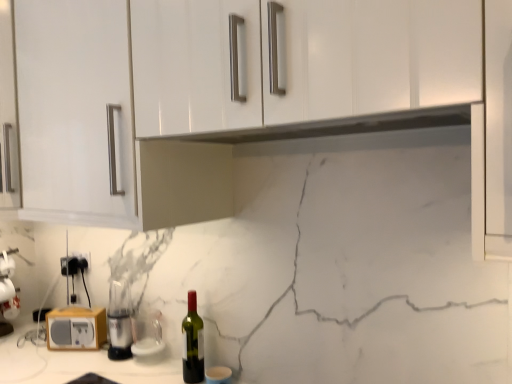
Describe the element at coordinates (76, 328) in the screenshot. I see `wooden radio at lower left, acting as the first appliance starting from the left` at that location.

Measure the distance between transparent glass at lower center, arranged as the third appliance when viewed from the left, and camera.

transparent glass at lower center, arranged as the third appliance when viewed from the left, is 5.10 feet away from camera.

Image resolution: width=512 pixels, height=384 pixels. What do you see at coordinates (119, 321) in the screenshot? I see `metallic silver blender at center, the 2th appliance from the left` at bounding box center [119, 321].

You are a GUI agent. You are given a task and a screenshot of the screen. Output one action in this format:
    pyautogui.click(x=<x>, y=<y>)
    Task: Click on the metallic silver blender at center, the second appliance in the right-to-left sequence
    
    Given the screenshot: What is the action you would take?
    pyautogui.click(x=119, y=321)

The height and width of the screenshot is (384, 512). Describe the element at coordinates (7, 291) in the screenshot. I see `translucent plastic blender at lower left` at that location.

How much space does black plastic electric outlet at lower left, which appears as the 2th electric outlet when viewed from the left, occupy vertically?

3.70 inches.

Identify the location of black plastic electric outlet at lower left, which appears as the 2th electric outlet when viewed from the left. Image resolution: width=512 pixels, height=384 pixels. (83, 257).

What do you see at coordinates (70, 266) in the screenshot? The width and height of the screenshot is (512, 384). I see `black plastic electric outlet at lower left, the 2th electric outlet when ordered from right to left` at bounding box center [70, 266].

In order to click on green glass bottle at center in this screenshot , I will do `click(192, 343)`.

From the image's perspective, relative to wooden radio at lower left, acting as the first appliance starting from the left, is black plastic electric outlet at lower left, which is the first electric outlet in right-to-left order, above or below?

Based on their image positions, black plastic electric outlet at lower left, which is the first electric outlet in right-to-left order, is located above wooden radio at lower left, acting as the first appliance starting from the left.

In terms of height, does black plastic electric outlet at lower left, which appears as the 2th electric outlet when viewed from the left, look taller or shorter compared to wooden radio at lower left, the third appliance when ordered from right to left?

Clearly, black plastic electric outlet at lower left, which appears as the 2th electric outlet when viewed from the left, is shorter compared to wooden radio at lower left, the third appliance when ordered from right to left.

Locate an element on the screen. This screenshot has height=384, width=512. the 1st electric outlet behind the wooden radio at lower left, the third appliance when ordered from right to left, counting from the anchor's position is located at coordinates (83, 257).

Between black plastic electric outlet at lower left, which is the first electric outlet in right-to-left order, and metallic silver blender at center, the second appliance in the right-to-left sequence, which one has smaller width?

With smaller width is black plastic electric outlet at lower left, which is the first electric outlet in right-to-left order.

Identify the location of the 2nd appliance below the black plastic electric outlet at lower left, which is the first electric outlet in right-to-left order (from the image's perspective). [x=119, y=321].

Is translucent plastic blender at lower left shorter than metallic silver blender at center, the second appliance in the right-to-left sequence?

No, translucent plastic blender at lower left is not shorter than metallic silver blender at center, the second appliance in the right-to-left sequence.

Is translucent plastic blender at lower left beside metallic silver blender at center, the 2th appliance from the left?

No, translucent plastic blender at lower left is not making contact with metallic silver blender at center, the 2th appliance from the left.

Is point (12, 268) farther from viewer compared to point (109, 306)?

Yes.

From a real-world perspective, which is physically below, translucent plastic blender at lower left or metallic silver blender at center, the second appliance in the right-to-left sequence?

From a 3D spatial view, metallic silver blender at center, the second appliance in the right-to-left sequence, is below.

Is green glass bottle at center facing away from metallic silver blender at center, the second appliance in the right-to-left sequence?

No, green glass bottle at center is not facing the opposite direction of metallic silver blender at center, the second appliance in the right-to-left sequence.

Is green glass bottle at center situated inside metallic silver blender at center, the second appliance in the right-to-left sequence, or outside?

green glass bottle at center is not inside metallic silver blender at center, the second appliance in the right-to-left sequence, it's outside.

From a real-world perspective, is green glass bottle at center positioned under metallic silver blender at center, the 2th appliance from the left, based on gravity?

Incorrect, from a real-world perspective, green glass bottle at center is higher than metallic silver blender at center, the 2th appliance from the left.

Measure the distance from green glass bottle at center to metallic silver blender at center, the second appliance in the right-to-left sequence.

They are 11.53 inches apart.

Between point (184, 325) and point (51, 337), which one is positioned in front?

The point (184, 325) is closer.

Does green glass bottle at center touch wooden radio at lower left, the third appliance when ordered from right to left?

No, green glass bottle at center is not next to wooden radio at lower left, the third appliance when ordered from right to left.

Is green glass bottle at center positioned with its back to wooden radio at lower left, the third appliance when ordered from right to left?

green glass bottle at center does not have its back to wooden radio at lower left, the third appliance when ordered from right to left.

Consider the image. Does green glass bottle at center lie behind wooden radio at lower left, acting as the first appliance starting from the left?

No, green glass bottle at center is in front of wooden radio at lower left, acting as the first appliance starting from the left.

From their relative heights in the image, would you say transparent glass at lower center, arranged as the first appliance when viewed from the right, is taller or shorter than green glass bottle at center?

In the image, transparent glass at lower center, arranged as the first appliance when viewed from the right, appears to be shorter than green glass bottle at center.

Looking at this image, from a real-world perspective, is transparent glass at lower center, arranged as the first appliance when viewed from the right, below green glass bottle at center?

Correct, in the physical world, transparent glass at lower center, arranged as the first appliance when viewed from the right, is lower than green glass bottle at center.

Can you confirm if transparent glass at lower center, arranged as the first appliance when viewed from the right, is smaller than green glass bottle at center?

Actually, transparent glass at lower center, arranged as the first appliance when viewed from the right, might be larger than green glass bottle at center.

From the picture: Between transparent glass at lower center, arranged as the first appliance when viewed from the right, and green glass bottle at center, which one has smaller width?

green glass bottle at center.

From the image's perspective, does black plastic electric outlet at lower left, the 2th electric outlet when ordered from right to left, appear lower than wooden radio at lower left, acting as the first appliance starting from the left?

No, from the image's perspective, black plastic electric outlet at lower left, the 2th electric outlet when ordered from right to left, is not below wooden radio at lower left, acting as the first appliance starting from the left.

From a real-world perspective, is black plastic electric outlet at lower left, the 1th electric outlet in the left-to-right sequence, located higher than wooden radio at lower left, acting as the first appliance starting from the left?

Indeed, from a real-world perspective, black plastic electric outlet at lower left, the 1th electric outlet in the left-to-right sequence, stands above wooden radio at lower left, acting as the first appliance starting from the left.

Is black plastic electric outlet at lower left, the 2th electric outlet when ordered from right to left, aimed at wooden radio at lower left, acting as the first appliance starting from the left?

No, black plastic electric outlet at lower left, the 2th electric outlet when ordered from right to left, is not aimed at wooden radio at lower left, acting as the first appliance starting from the left.

Considering the positions of objects black plastic electric outlet at lower left, the 2th electric outlet when ordered from right to left, and wooden radio at lower left, acting as the first appliance starting from the left, in the image provided, who is more to the left, black plastic electric outlet at lower left, the 2th electric outlet when ordered from right to left, or wooden radio at lower left, acting as the first appliance starting from the left,?

black plastic electric outlet at lower left, the 2th electric outlet when ordered from right to left, is more to the left.

Which electric outlet is the 1st one when counting from the back of the wooden radio at lower left, acting as the first appliance starting from the left? Please provide its 2D coordinates.

[(83, 257)]

From a real-world perspective, starting from the black plastic electric outlet at lower left, which is the first electric outlet in right-to-left order, which appliance is the 2nd one below it? Please provide its 2D coordinates.

[(119, 321)]

Looking at the image, which one is located closer to black plastic electric outlet at lower left, which appears as the 2th electric outlet when viewed from the left, transparent glass at lower center, arranged as the first appliance when viewed from the right, or black plastic electric outlet at lower left, the 1th electric outlet in the left-to-right sequence?

Among the two, black plastic electric outlet at lower left, the 1th electric outlet in the left-to-right sequence, is located nearer to black plastic electric outlet at lower left, which appears as the 2th electric outlet when viewed from the left.

Which object lies further to the anchor point metallic silver blender at center, the 2th appliance from the left, black plastic electric outlet at lower left, which appears as the 2th electric outlet when viewed from the left, or green glass bottle at center?

The object further to metallic silver blender at center, the 2th appliance from the left, is black plastic electric outlet at lower left, which appears as the 2th electric outlet when viewed from the left.

Based on their spatial positions, is green glass bottle at center or transparent glass at lower center, arranged as the first appliance when viewed from the right, further from black plastic electric outlet at lower left, the 1th electric outlet in the left-to-right sequence?

Based on the image, green glass bottle at center appears to be further to black plastic electric outlet at lower left, the 1th electric outlet in the left-to-right sequence.

In the scene shown: Which object lies further to the anchor point black plastic electric outlet at lower left, which is the first electric outlet in right-to-left order, wooden radio at lower left, acting as the first appliance starting from the left, or transparent glass at lower center, arranged as the third appliance when viewed from the left?

transparent glass at lower center, arranged as the third appliance when viewed from the left, is positioned further to the anchor black plastic electric outlet at lower left, which is the first electric outlet in right-to-left order.

Which object lies nearer to the anchor point wooden radio at lower left, the third appliance when ordered from right to left, translucent plastic blender at lower left or black plastic electric outlet at lower left, which appears as the 2th electric outlet when viewed from the left?

black plastic electric outlet at lower left, which appears as the 2th electric outlet when viewed from the left, is closer to wooden radio at lower left, the third appliance when ordered from right to left.

Looking at the image, which one is located closer to green glass bottle at center, metallic silver blender at center, the second appliance in the right-to-left sequence, or black plastic electric outlet at lower left, the 2th electric outlet when ordered from right to left?

metallic silver blender at center, the second appliance in the right-to-left sequence, lies closer to green glass bottle at center than the other object.

Which object lies nearer to the anchor point translucent plastic blender at lower left, black plastic electric outlet at lower left, the 1th electric outlet in the left-to-right sequence, or black plastic electric outlet at lower left, which is the first electric outlet in right-to-left order?

black plastic electric outlet at lower left, the 1th electric outlet in the left-to-right sequence, is closer to translucent plastic blender at lower left.

Looking at the image, which one is located further to wooden radio at lower left, the third appliance when ordered from right to left, transparent glass at lower center, arranged as the first appliance when viewed from the right, or black plastic electric outlet at lower left, which is the first electric outlet in right-to-left order?

The object further to wooden radio at lower left, the third appliance when ordered from right to left, is black plastic electric outlet at lower left, which is the first electric outlet in right-to-left order.

The image size is (512, 384). Find the location of `electric outlet between black plastic electric outlet at lower left, the 2th electric outlet when ordered from right to left, and transparent glass at lower center, arranged as the third appliance when viewed from the left, from left to right`. electric outlet between black plastic electric outlet at lower left, the 2th electric outlet when ordered from right to left, and transparent glass at lower center, arranged as the third appliance when viewed from the left, from left to right is located at coordinates (83, 257).

Locate an element on the screen. appliance between metallic silver blender at center, the second appliance in the right-to-left sequence, and black plastic electric outlet at lower left, which appears as the 2th electric outlet when viewed from the left, in the front-back direction is located at coordinates (76, 328).

I want to click on appliance between metallic silver blender at center, the second appliance in the right-to-left sequence, and black plastic electric outlet at lower left, the 1th electric outlet in the left-to-right sequence, along the z-axis, so click(x=76, y=328).

This screenshot has width=512, height=384. What are the coordinates of `appliance between metallic silver blender at center, the 2th appliance from the left, and green glass bottle at center from left to right` in the screenshot? It's located at (148, 337).